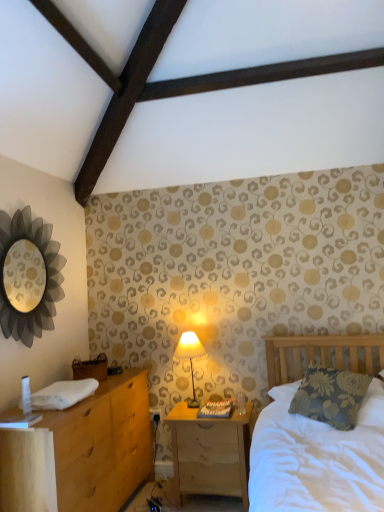
Question: In the image, is wooden nightstand at lower center positioned in front of or behind metallic silver mirror at upper left?

Choices:
 (A) front
 (B) behind

Answer: (B)

Question: From the image's perspective, is wooden nightstand at lower center above or below metallic silver mirror at upper left?

Choices:
 (A) above
 (B) below

Answer: (B)

Question: Estimate the real-world distances between objects in this image. Which object is farther from the metallic silver mirror at upper left?

Choices:
 (A) wooden nightstand at lower center
 (B) matte cream fabric lampshade at center
 (C) light brown wood chest of drawers at left
 (D) floral fabric pillow at right

Answer: (D)

Question: Considering the real-world distances, which object is closest to the matte cream fabric lampshade at center?

Choices:
 (A) wooden nightstand at lower center
 (B) light brown wood chest of drawers at left
 (C) floral fabric pillow at right
 (D) metallic silver mirror at upper left

Answer: (A)